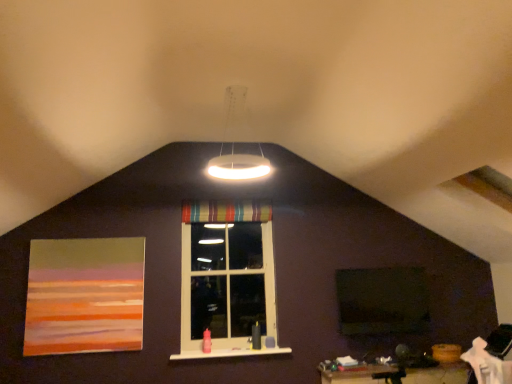
Question: From the image's perspective, is striped fabric curtain at center on white glossy ring light at upper center?

Choices:
 (A) yes
 (B) no

Answer: (B)

Question: From a real-world perspective, is striped fabric curtain at center below white glossy ring light at upper center?

Choices:
 (A) yes
 (B) no

Answer: (A)

Question: Considering the relative positions of striped fabric curtain at center and white glossy ring light at upper center in the image provided, is striped fabric curtain at center to the left of white glossy ring light at upper center from the viewer's perspective?

Choices:
 (A) no
 (B) yes

Answer: (B)

Question: Does striped fabric curtain at center lie in front of white glossy ring light at upper center?

Choices:
 (A) yes
 (B) no

Answer: (B)

Question: Is striped fabric curtain at center oriented away from white glossy ring light at upper center?

Choices:
 (A) no
 (B) yes

Answer: (A)

Question: Does striped fabric curtain at center have a lesser width compared to white glossy ring light at upper center?

Choices:
 (A) yes
 (B) no

Answer: (A)

Question: Does white glossy wood at center have a lesser height compared to striped fabric window at center?

Choices:
 (A) yes
 (B) no

Answer: (A)

Question: Is the depth of white glossy wood at center greater than that of striped fabric window at center?

Choices:
 (A) yes
 (B) no

Answer: (B)

Question: From a real-world perspective, is white glossy wood at center beneath striped fabric window at center?

Choices:
 (A) no
 (B) yes

Answer: (B)

Question: Does white glossy wood at center have a lesser width compared to striped fabric window at center?

Choices:
 (A) yes
 (B) no

Answer: (B)

Question: Could striped fabric window at center be considered to be inside white glossy wood at center?

Choices:
 (A) yes
 (B) no

Answer: (B)

Question: Does white glossy wood at center appear on the left side of striped fabric window at center?

Choices:
 (A) yes
 (B) no

Answer: (B)

Question: Considering the relative positions of green matte window screen at center and white glossy ring light at upper center in the image provided, is green matte window screen at center to the right of white glossy ring light at upper center from the viewer's perspective?

Choices:
 (A) no
 (B) yes

Answer: (B)